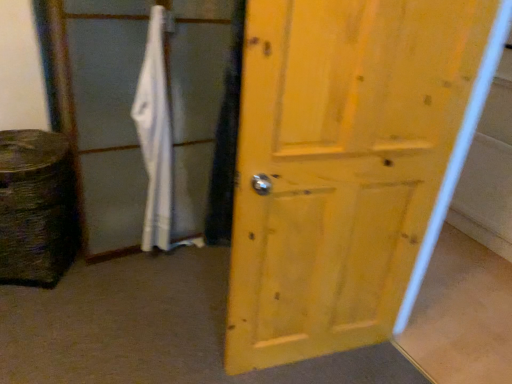
Question: Is matte white screen door at center wider or thinner than white fabric bath towel at center-left?

Choices:
 (A) thin
 (B) wide

Answer: (B)

Question: Choose the correct answer: Is matte white screen door at center inside white fabric bath towel at center-left or outside it?

Choices:
 (A) outside
 (B) inside

Answer: (A)

Question: Based on their relative distances, which object is farther from the white fabric bath towel at center-left?

Choices:
 (A) matte white screen door at center
 (B) yellow wood door at center

Answer: (B)

Question: Estimate the real-world distances between objects in this image. Which object is closer to the matte white screen door at center?

Choices:
 (A) white fabric bath towel at center-left
 (B) yellow wood door at center

Answer: (A)